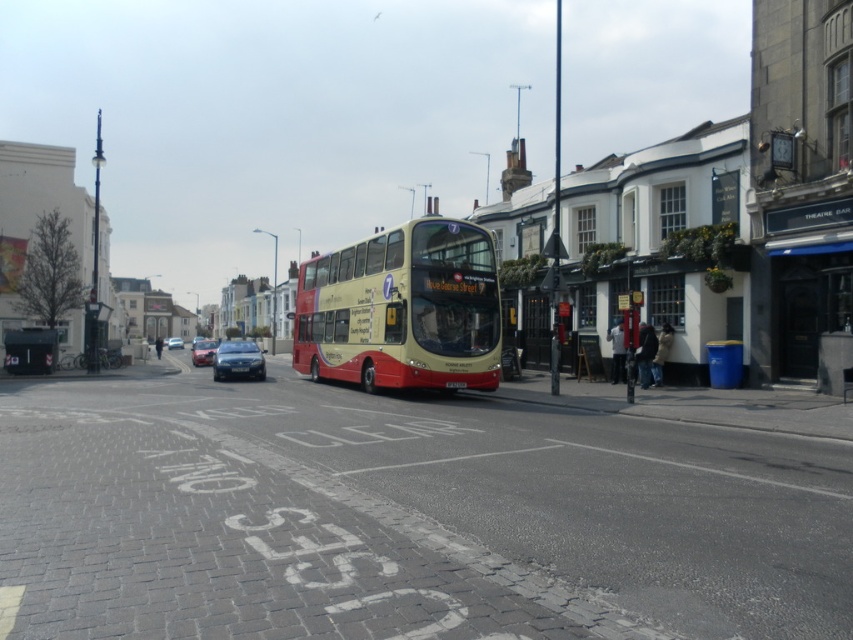
Question: Which point appears farthest from the camera in this image?

Choices:
 (A) (206, 339)
 (B) (244, 371)

Answer: (A)

Question: Does yellow matte/decorative bus at center have a lesser width compared to shiny silver sedan at center?

Choices:
 (A) yes
 (B) no

Answer: (B)

Question: Among these points, which one is farthest from the camera?

Choices:
 (A) (165, 344)
 (B) (402, 376)
 (C) (241, 348)

Answer: (A)

Question: Is shiny silver sedan at center thinner than shiny black sedan at center?

Choices:
 (A) no
 (B) yes

Answer: (B)

Question: Which is nearer to the yellow matte/decorative bus at center?

Choices:
 (A) metallic silver car at center
 (B) shiny silver sedan at center

Answer: (B)

Question: Can you confirm if shiny silver sedan at center is smaller than shiny black sedan at center?

Choices:
 (A) no
 (B) yes

Answer: (B)